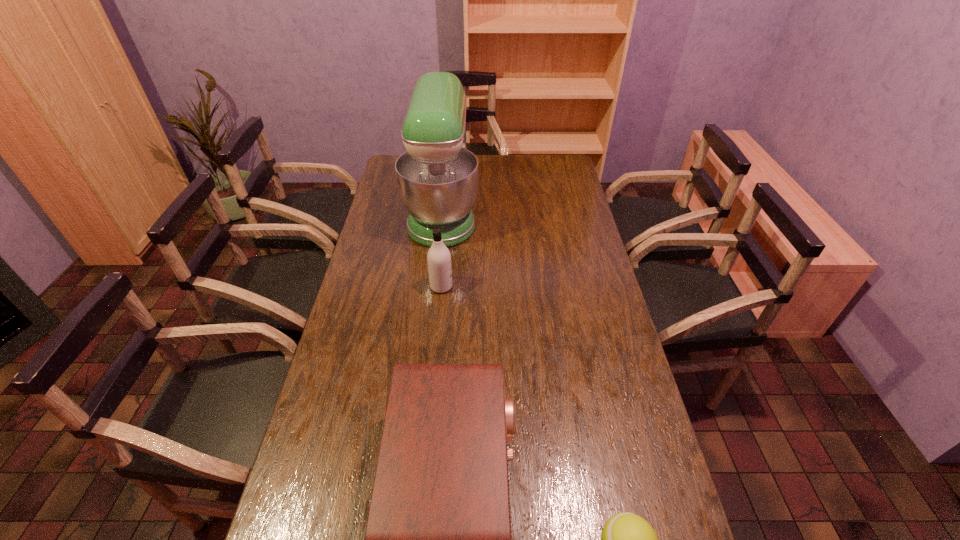
The width and height of the screenshot is (960, 540). In order to click on the farthest object in this screenshot , I will do `click(437, 177)`.

At what (x,y) coordinates should I click in order to perform the action: click on mixer. Please return your answer as a coordinate pair (x, y). Looking at the image, I should click on (437, 177).

I want to click on the third nearest object, so click(x=439, y=258).

What are the coordinates of `vacant space located on the controls of the tallest object` in the screenshot? It's located at (547, 212).

Locate an element on the screen. This screenshot has width=960, height=540. vacant position located on the front-facing side of the second farthest object is located at coordinates (468, 287).

Where is `object that is positioned at the left edge`? object that is positioned at the left edge is located at coordinates (437, 177).

Locate an element on the screen. This screenshot has width=960, height=540. free space at the left edge of the desktop is located at coordinates (369, 423).

Where is `free spot at the right edge of the desktop`? This screenshot has width=960, height=540. free spot at the right edge of the desktop is located at coordinates (612, 401).

Identify the location of object that is the third closest to the radio receiver. The width and height of the screenshot is (960, 540). (437, 177).

Identify which object is the second closest to the third nearest object. Please provide its 2D coordinates. Your answer should be formatted as a tuple, i.e. [(x, y)], where the tuple contains the x and y coordinates of a point satisfying the conditions above.

[(438, 539)]